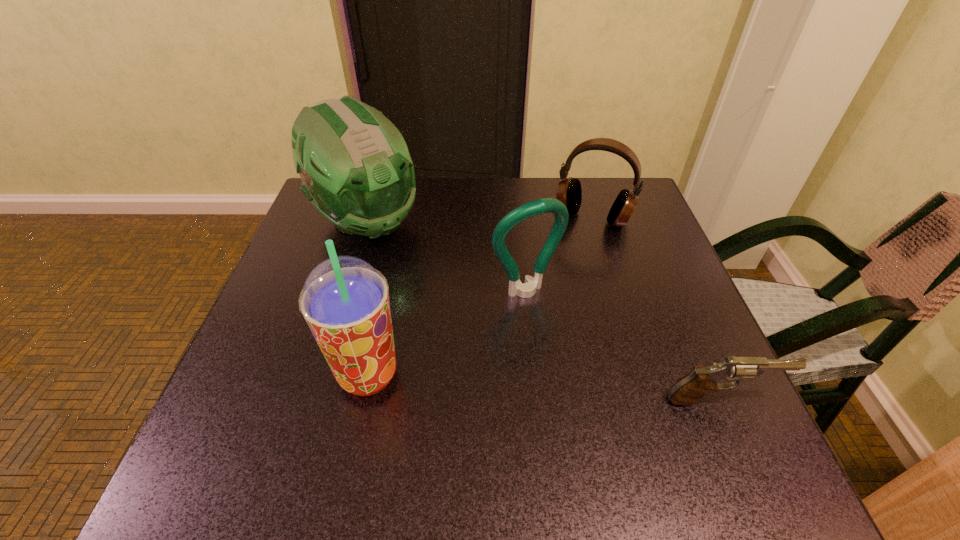
Locate an element on the screen. This screenshot has height=540, width=960. object situated at the left edge is located at coordinates (356, 170).

This screenshot has width=960, height=540. In order to click on pistol at the right edge in this screenshot , I will do `click(689, 389)`.

You are a GUI agent. You are given a task and a screenshot of the screen. Output one action in this format:
    pyautogui.click(x=<x>, y=<y>)
    Task: Click on the headset located in the right edge section of the desktop
    The height and width of the screenshot is (540, 960).
    Given the screenshot: What is the action you would take?
    pyautogui.click(x=569, y=192)

Find the location of `object situated at the far left corner`. object situated at the far left corner is located at coordinates (356, 170).

The image size is (960, 540). In order to click on object that is at the far right corner in this screenshot , I will do `click(569, 192)`.

You are a GUI agent. You are given a task and a screenshot of the screen. Output one action in this format:
    pyautogui.click(x=<x>, y=<y>)
    Task: Click on the object present at the near right corner
    
    Given the screenshot: What is the action you would take?
    pyautogui.click(x=689, y=389)

Where is `vacant space at the far edge of the desktop`? vacant space at the far edge of the desktop is located at coordinates (433, 210).

Find the location of a particular element. This screenshot has height=540, width=960. blank space at the near edge of the desktop is located at coordinates (564, 425).

The width and height of the screenshot is (960, 540). Identify the location of free location at the left edge of the desktop. (311, 339).

This screenshot has height=540, width=960. What are the coordinates of `free space at the right edge of the desktop` in the screenshot? It's located at (640, 365).